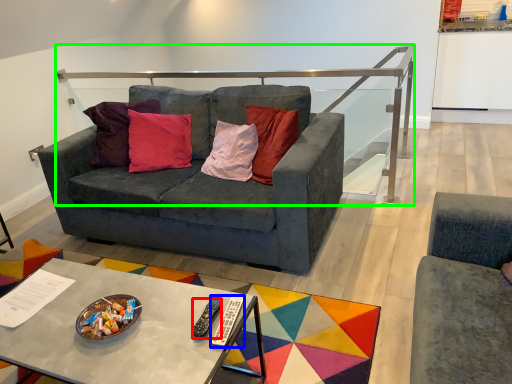
Question: Which object is positioned closest to remote (highlighted by a red box)? Select from remote (highlighted by a blue box) and balustrade (highlighted by a green box).

Choices:
 (A) remote
 (B) balustrade

Answer: (A)